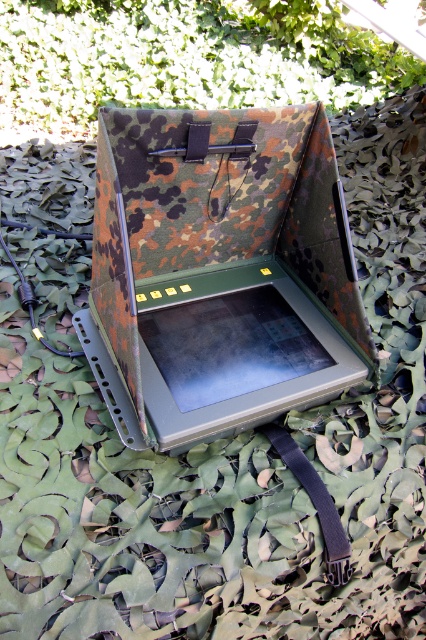
You are a field technician needing to pack both the camo fabric laptop at center and the matte black tablet at center into a storage case. The case has a compartment that can only fit one of them. Which device should you place in the compartment first to ensure both fit?

The camo fabric laptop at center is larger in size than the matte black tablet at center, so you should place the camo fabric laptop at center first to make space for the smaller tablet.

You are a field technician needing to secure the camo fabric laptop at center with the black fabric strap at center. Given their sizes, will the strap be long enough to wrap around the laptop?

The camo fabric laptop at center is wider than the black fabric strap at center, so the strap may not be long enough to fully secure around the laptop.

You are a field technician holding a tool that requires placing it precisely at point [259,298] on the device. The tool has a maximum reach of 4 feet. Can you reach the point without moving closer?

The distance between point [259,298] and the camera is 4.44 feet. Since the tool can only reach up to 4 feet, you cannot reach the point without moving closer.